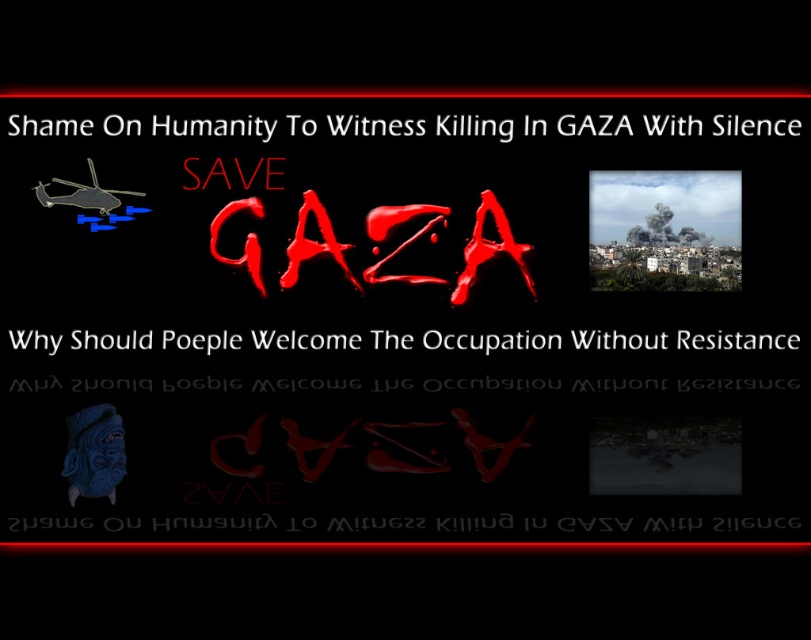
Question: Does blood-like text save gaza at center have a lesser width compared to smokematerial/texture at upper right?

Choices:
 (A) yes
 (B) no

Answer: (B)

Question: Can you confirm if white text at center is wider than dripping blood text at center?

Choices:
 (A) yes
 (B) no

Answer: (A)

Question: Can you confirm if blood-like text save gaza at center is positioned to the right of smokematerial/texture at upper right?

Choices:
 (A) no
 (B) yes

Answer: (A)

Question: Which object appears farthest from the camera in this image?

Choices:
 (A) dripping blood text at center
 (B) smokematerial/texture at upper right
 (C) white text at center

Answer: (A)

Question: Among these points, which one is nearest to the camera?

Choices:
 (A) (745, 346)
 (B) (464, 266)
 (C) (200, 102)

Answer: (C)

Question: Which object is positioned closest to the dripping blood text at center?

Choices:
 (A) smokematerial/texture at upper right
 (B) white text at center

Answer: (B)